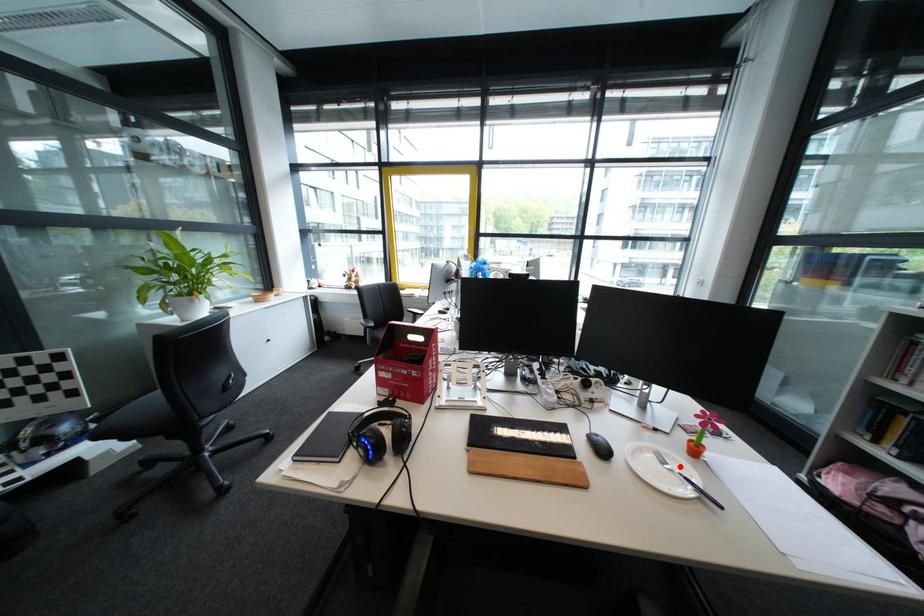
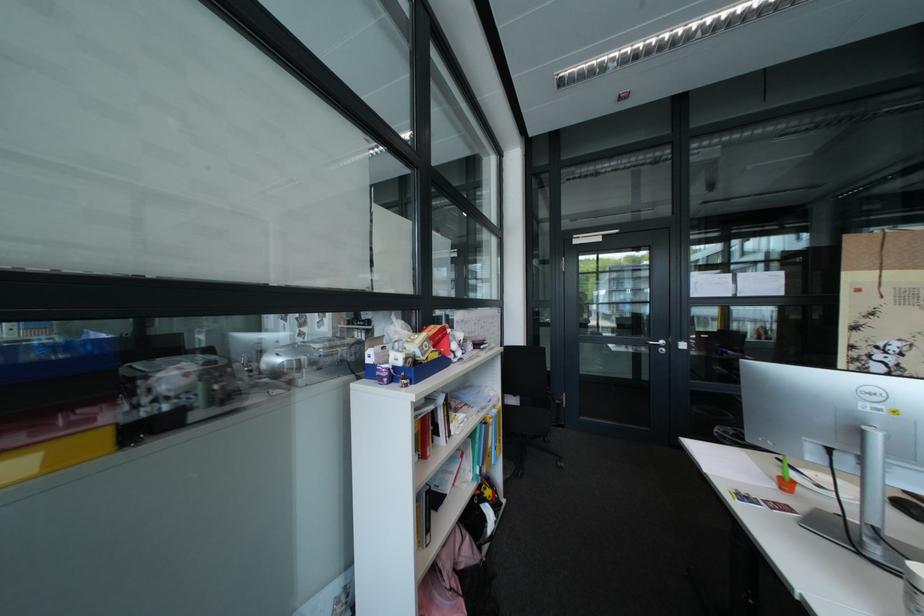
Question: I am providing you with two images of the same scene from different viewpoints. A red point is marked on the first image. At the location where the point appears in image 1, is it still visible in image 2?

Choices:
 (A) Yes
 (B) No

Answer: (B)